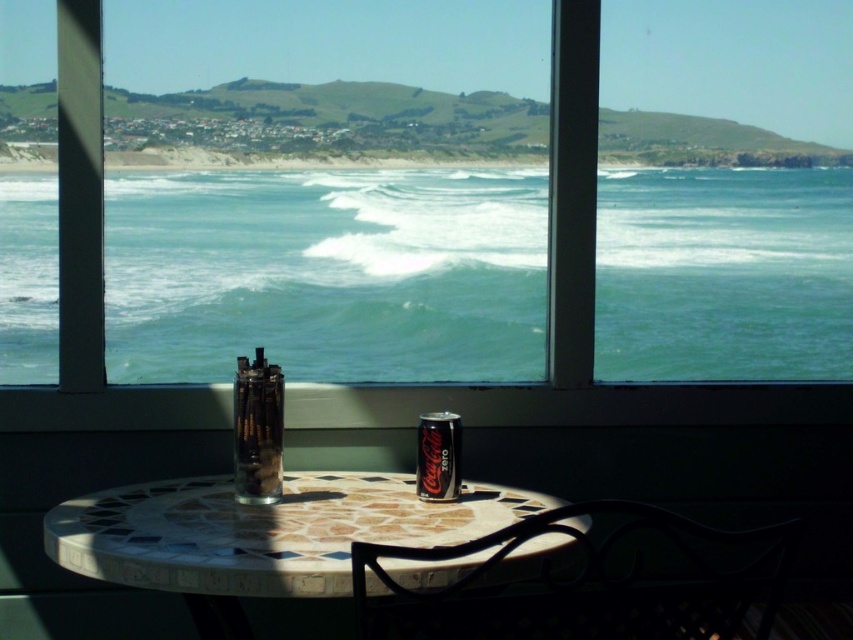
Can you confirm if metallic black chair at lower right is smaller than metallic silver can at center?

Actually, metallic black chair at lower right might be larger than metallic silver can at center.

Which is behind, point (373, 628) or point (460, 477)?

The point (460, 477) is more distant.

Image resolution: width=853 pixels, height=640 pixels. What are the coordinates of `metallic black chair at lower right` in the screenshot? It's located at (585, 580).

Does mosaic tile table at center appear on the right side of metallic silver can at center?

In fact, mosaic tile table at center is to the left of metallic silver can at center.

Is point (444, 547) farther from viewer compared to point (434, 422)?

No, (444, 547) is closer to viewer.

Identify the location of mosaic tile table at center. (265, 531).

Can you confirm if greenish-blue water at center is positioned to the right of clear glass at center?

Yes, greenish-blue water at center is to the right of clear glass at center.

Who is shorter, greenish-blue water at center or clear glass at center?

Standing shorter between the two is clear glass at center.

Does point (697, 305) come behind point (254, 496)?

Yes, point (697, 305) is behind point (254, 496).

At what (x,y) coordinates should I click in order to perform the action: click on greenish-blue water at center. Please return your answer as a coordinate pair (x, y). Looking at the image, I should click on (326, 273).